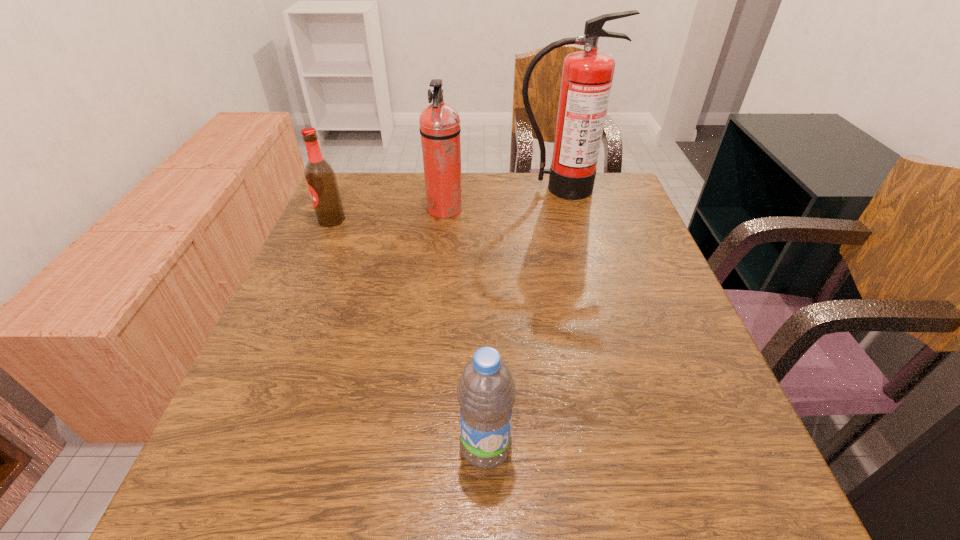
Where is `vacant region located on the left of the nearest object`? vacant region located on the left of the nearest object is located at coordinates (422, 448).

Find the location of `beer bottle present at the far edge`. beer bottle present at the far edge is located at coordinates (321, 180).

The image size is (960, 540). What are the coordinates of `object that is at the near edge` in the screenshot? It's located at (486, 392).

Where is `object that is at the left edge`? This screenshot has width=960, height=540. object that is at the left edge is located at coordinates pyautogui.click(x=321, y=180).

You are a GUI agent. You are given a task and a screenshot of the screen. Output one action in this format:
    pyautogui.click(x=<x>, y=<y>)
    Task: Click on the object at the right edge
    The height and width of the screenshot is (540, 960).
    Given the screenshot: What is the action you would take?
    pyautogui.click(x=587, y=75)

The width and height of the screenshot is (960, 540). I want to click on object at the far left corner, so click(321, 180).

You are a GUI agent. You are given a task and a screenshot of the screen. Output one action in this format:
    pyautogui.click(x=<x>, y=<y>)
    Task: Click on the object that is at the far right corner
    Image resolution: width=960 pixels, height=540 pixels.
    Given the screenshot: What is the action you would take?
    pyautogui.click(x=587, y=75)

Find the location of a particular element. free location at the far edge is located at coordinates (524, 210).

In the image, there is a desktop. Identify the location of vacant space at the near edge. (616, 492).

Locate an element on the screen. The image size is (960, 540). vacant space at the left edge of the desktop is located at coordinates (349, 245).